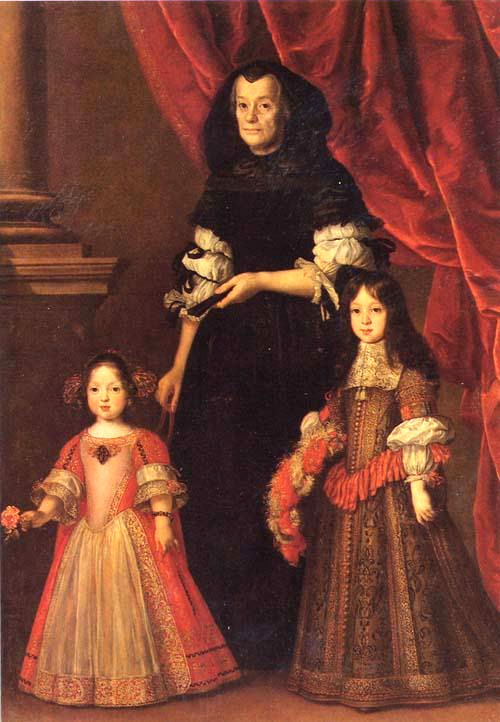
Identify the location of column. Image resolution: width=500 pixels, height=722 pixels. (23, 133).